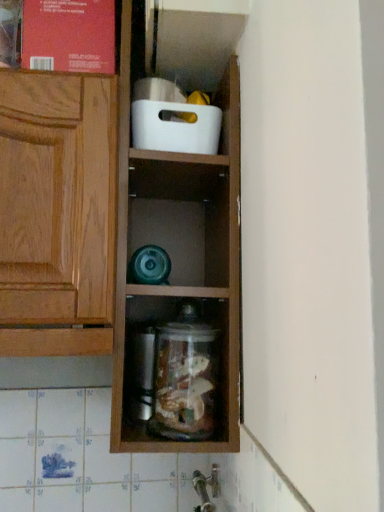
Question: Considering their positions, is matte red book at upper left located in front of or behind clear glass jar at center?

Choices:
 (A) front
 (B) behind

Answer: (B)

Question: Considering the positions of point (100, 31) and point (150, 428), is point (100, 31) closer or farther from the camera than point (150, 428)?

Choices:
 (A) closer
 (B) farther

Answer: (B)

Question: Based on their relative distances, which object is farther from the white plastic container at upper center?

Choices:
 (A) matte red book at upper left
 (B) clear glass jar at center
 (C) silver metallic faucet at lower center

Answer: (C)

Question: Considering the real-world distances, which object is closest to the clear glass jar at center?

Choices:
 (A) matte red book at upper left
 (B) white plastic container at upper center
 (C) silver metallic faucet at lower center

Answer: (C)